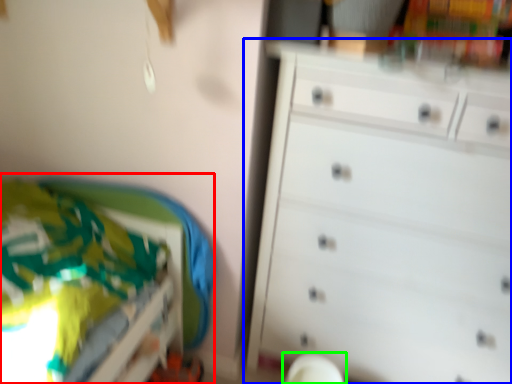
Question: Which is nearer to the bed (highlighted by a red box)? chest of drawers (highlighted by a blue box) or swivel chair (highlighted by a green box).

Choices:
 (A) chest of drawers
 (B) swivel chair

Answer: (A)